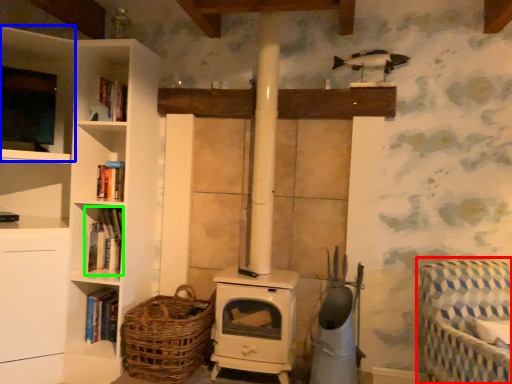
Question: Which object is the farthest from rocking chair (highlighted by a red box)? Choose among these: shelf (highlighted by a blue box) or book (highlighted by a green box).

Choices:
 (A) shelf
 (B) book

Answer: (A)